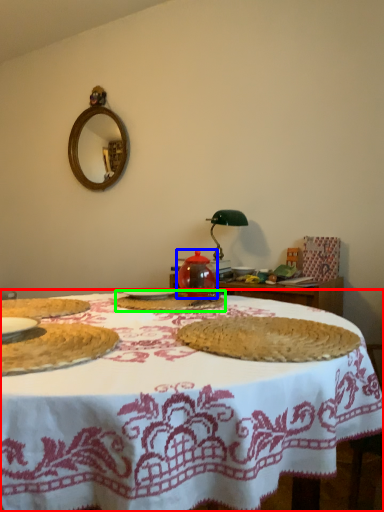
Question: Considering the real-world distances, which object is closest to table (highlighted by a red box)? tea pot (highlighted by a blue box) or food (highlighted by a green box).

Choices:
 (A) tea pot
 (B) food

Answer: (B)